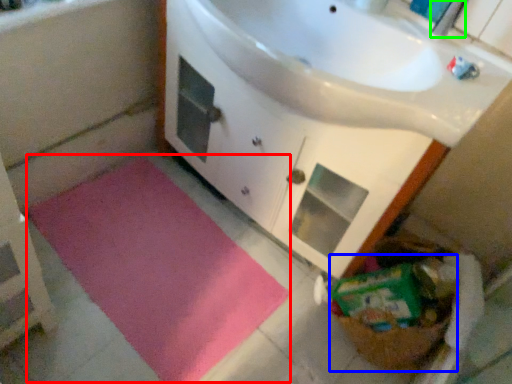
Question: Which object is positioned farthest from bath mat (highlighted by a red box)? Select from basket (highlighted by a blue box) and faucet (highlighted by a green box).

Choices:
 (A) basket
 (B) faucet

Answer: (B)